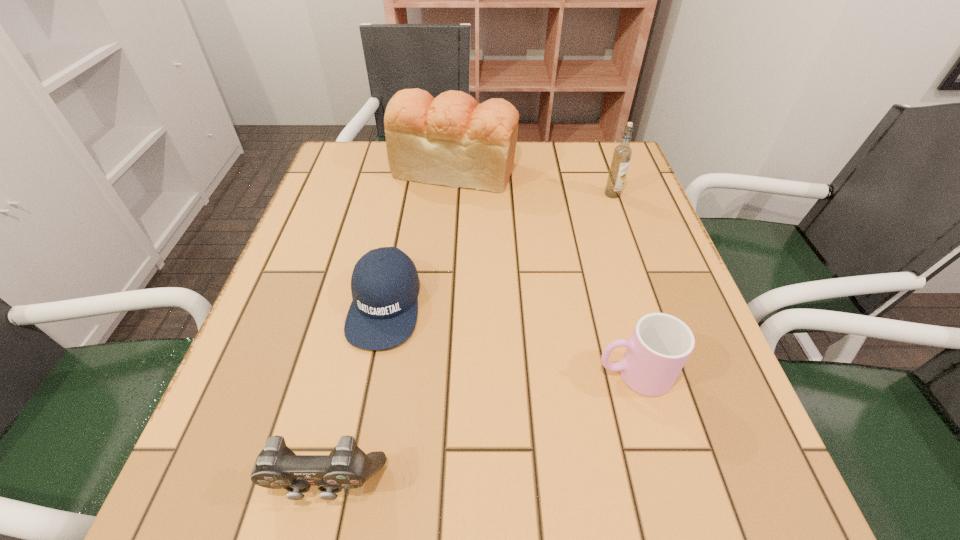
This screenshot has width=960, height=540. I want to click on empty space that is in between the vodka and the cup, so click(x=623, y=284).

Locate an element on the screen. blank region between the shortest object and the vodka is located at coordinates (498, 249).

What are the coordinates of `vacant area that lies between the vodka and the second nearest object` in the screenshot? It's located at (623, 284).

Identify the location of the closest object to the bread. The image size is (960, 540). (622, 153).

The height and width of the screenshot is (540, 960). I want to click on the fourth closest object to the vodka, so click(277, 467).

Find the location of a particular element. free point that satisfies the following two spatial constraints: 1. on the front-facing side of the baseball cap; 2. with the handle on the side of the cup is located at coordinates (371, 374).